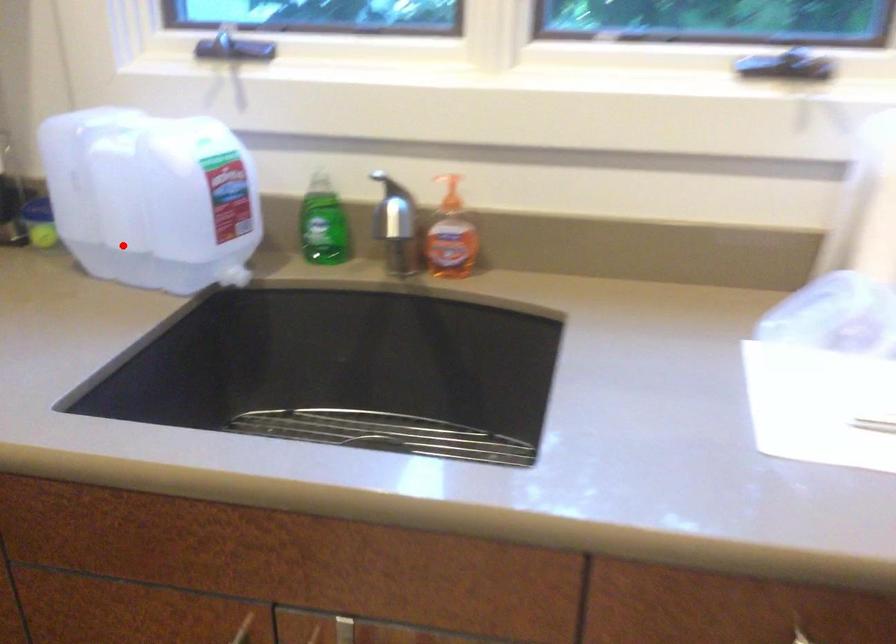
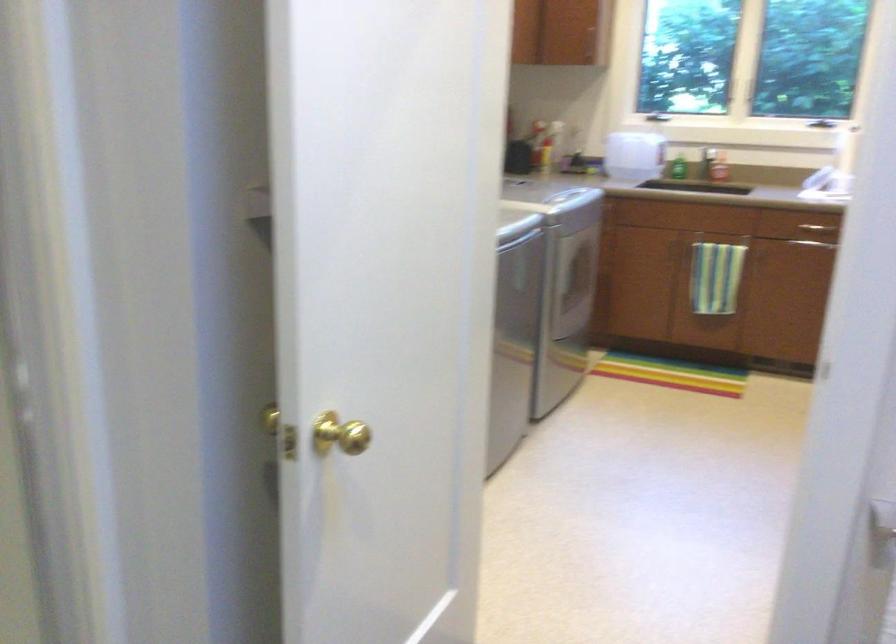
Question: I am providing you with two images of the same scene from different viewpoints. In image1, a red point is highlighted. Considering the same 3D point in image2, which of the following is correct?

Choices:
 (A) It is closer
 (B) It is farther

Answer: (B)